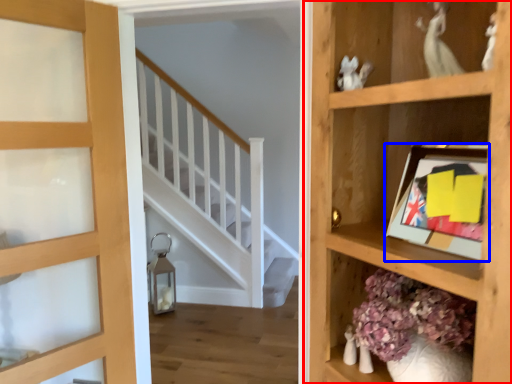
Question: Which object appears farthest to the camera in this image, shelf (highlighted by a red box) or picture frame (highlighted by a blue box)?

Choices:
 (A) shelf
 (B) picture frame

Answer: (B)